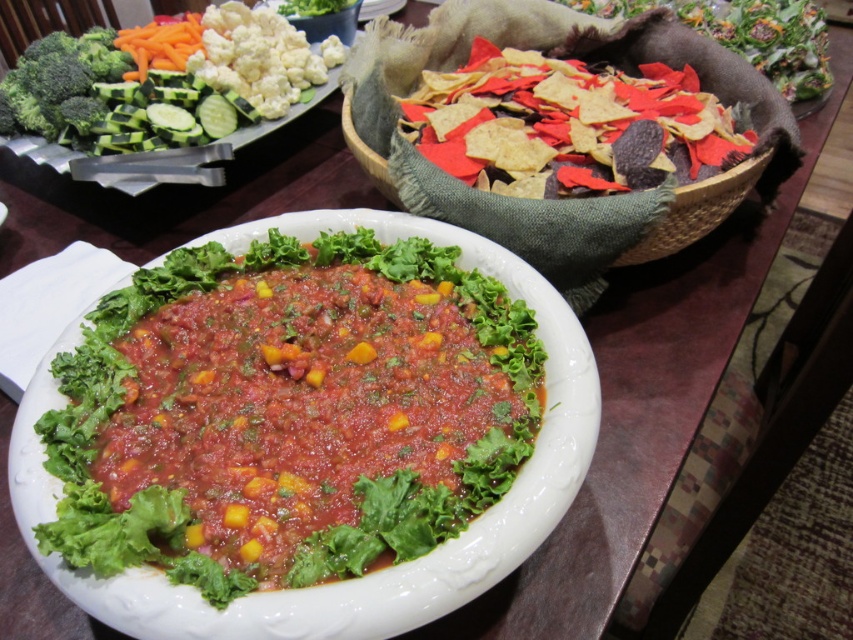
Is tomato-based salsa at center below green leafy vegetable at upper left?

Yes.

Measure the distance from tomato-based salsa at center to green leafy vegetable at upper left.

tomato-based salsa at center is 24.90 inches from green leafy vegetable at upper left.

Is point (183, 248) positioned before point (260, 113)?

Yes.

The width and height of the screenshot is (853, 640). In order to click on tomato-based salsa at center in this screenshot , I will do `click(288, 412)`.

Can you confirm if green leafy vegetable at upper right is bigger than green matte broccoli at upper left?

Yes.

In the scene shown: Can you confirm if green leafy vegetable at upper right is positioned below green matte broccoli at upper left?

Actually, green leafy vegetable at upper right is above green matte broccoli at upper left.

Does point (625, 3) lie in front of point (91, 96)?

No.

Image resolution: width=853 pixels, height=640 pixels. I want to click on green leafy vegetable at upper right, so click(x=749, y=35).

Who is lower down, tomato-based salsa at center or multicolored tortilla chips at upper right?

tomato-based salsa at center

Between point (190, 432) and point (509, 163), which one is positioned in front?

Point (190, 432) is more forward.

Is point (198, 308) behind point (434, 102)?

That is False.

I want to click on tomato-based salsa at center, so click(288, 412).